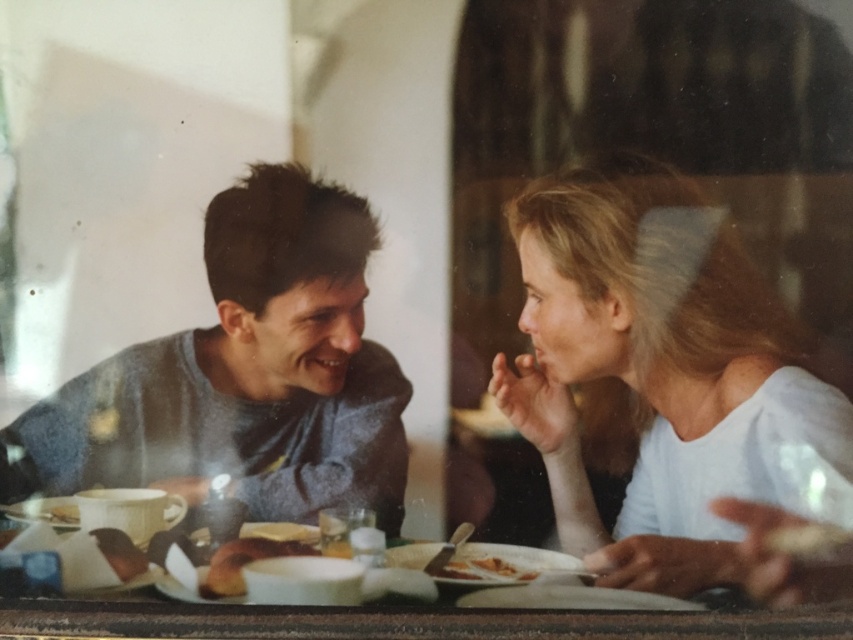
Is point (660, 349) closer to viewer compared to point (769, 376)?

No.

What do you see at coordinates (648, 356) in the screenshot? This screenshot has width=853, height=640. I see `matte gray sweater at center` at bounding box center [648, 356].

Identify the location of matte gray sweater at center. This screenshot has width=853, height=640. (648, 356).

Does white matte shirt at upper right appear over wooden table at center?

Yes, white matte shirt at upper right is above wooden table at center.

Does white matte shirt at upper right have a greater width compared to wooden table at center?

In fact, white matte shirt at upper right might be narrower than wooden table at center.

The image size is (853, 640). In order to click on white matte shirt at upper right in this screenshot , I will do `click(659, 371)`.

This screenshot has width=853, height=640. I want to click on white matte shirt at upper right, so click(x=659, y=371).

Which is above, gray cotton sweater at left or golden crispy pastry at lower center?

gray cotton sweater at left is higher up.

Does gray cotton sweater at left have a greater height compared to golden crispy pastry at lower center?

Yes.

Does point (297, 506) come farther from viewer compared to point (467, 570)?

No, it is not.

At what (x,y) coordinates should I click in order to perform the action: click on gray cotton sweater at left. Please return your answer as a coordinate pair (x, y). The width and height of the screenshot is (853, 640). Looking at the image, I should click on tap(244, 374).